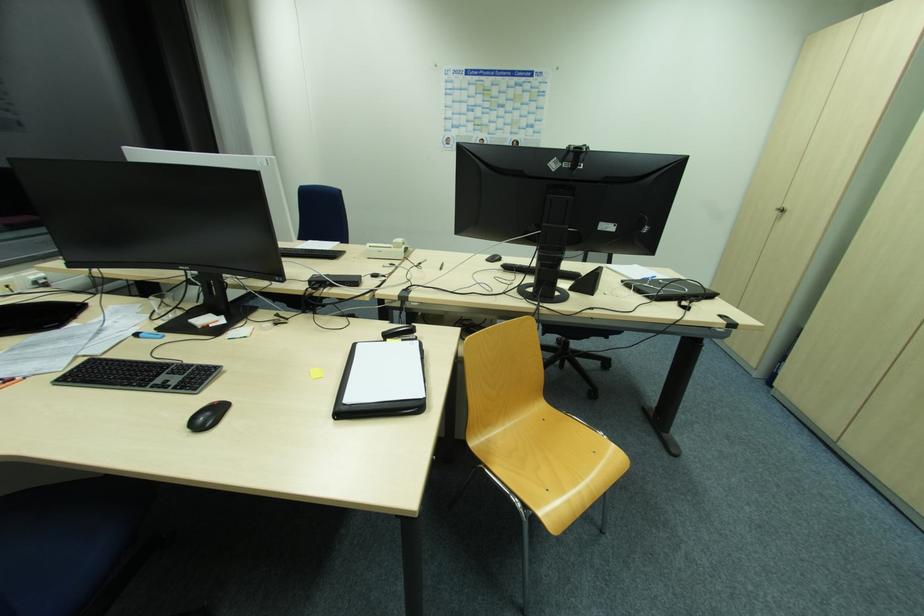
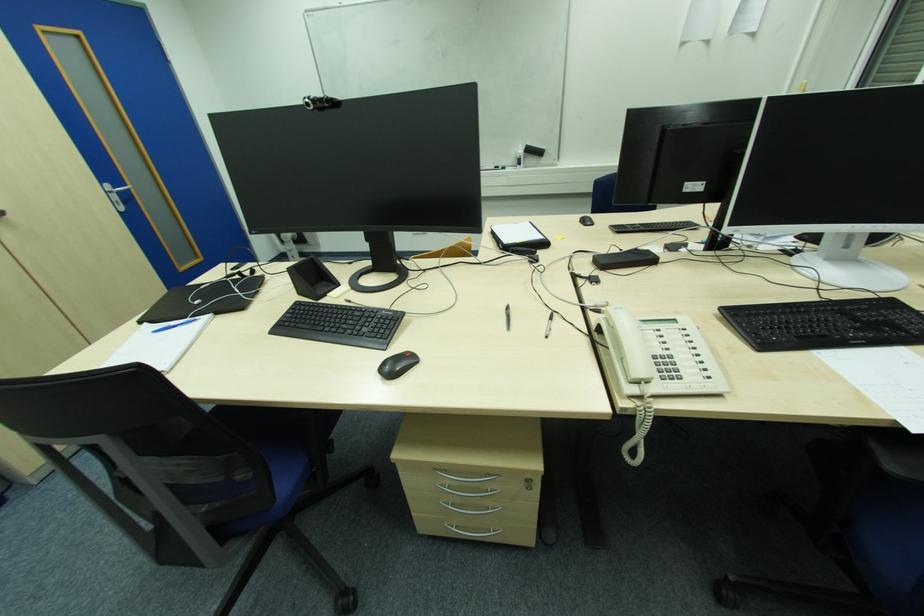
Where in the second image is the point corresponding to point (443, 270) from the first image?

(509, 309)